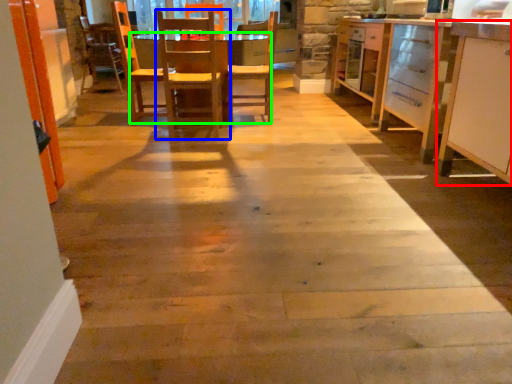
Question: Which object is positioned farthest from cabinetry (highlighted by a red box)? Select from chair (highlighted by a blue box) and table (highlighted by a green box).

Choices:
 (A) chair
 (B) table

Answer: (B)